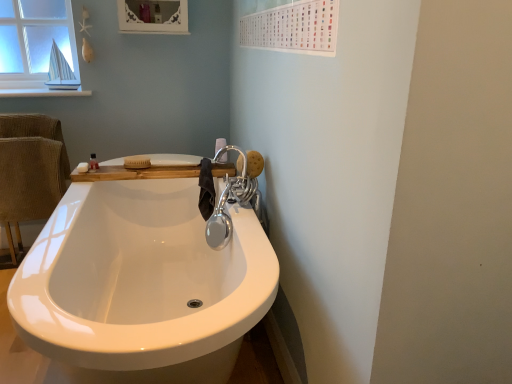
What are the coordinates of `white glossy toilet paper at upper center` in the screenshot? It's located at [220, 144].

Describe the element at coordinates (220, 144) in the screenshot. I see `white glossy toilet paper at upper center` at that location.

The width and height of the screenshot is (512, 384). In order to click on shiny metallic faucet at upper right in this screenshot , I will do `click(231, 201)`.

Describe the element at coordinates (135, 173) in the screenshot. The height and width of the screenshot is (384, 512). I see `woodenmaterial/texturecounter top at upper center` at that location.

You are a GUI agent. You are given a task and a screenshot of the screen. Output one action in this format:
    pyautogui.click(x=<x>, y=<y>)
    Task: Click on the white glossy toilet paper at upper center
    
    Given the screenshot: What is the action you would take?
    pyautogui.click(x=220, y=144)

At what (x,y) coordinates should I click in order to perform the action: click on armchair that is behind the white matte soap at upper left. Please return your answer as a coordinate pair (x, y). Looking at the image, I should click on (28, 185).

Which is behind, point (82, 166) or point (36, 213)?

Positioned behind is point (36, 213).

Based on the photo, measure the distance between white matte soap at upper left and beige corduroy armchair at left.

A distance of 22.17 inches exists between white matte soap at upper left and beige corduroy armchair at left.

Does white matte soap at upper left turn towards beige corduroy armchair at left?

No, white matte soap at upper left is not oriented towards beige corduroy armchair at left.

Can you confirm if woodenmaterial/texturecounter top at upper center is shorter than beige corduroy armchair at left?

Correct, woodenmaterial/texturecounter top at upper center is not as tall as beige corduroy armchair at left.

Is woodenmaterial/texturecounter top at upper center smaller than beige corduroy armchair at left?

Indeed, woodenmaterial/texturecounter top at upper center has a smaller size compared to beige corduroy armchair at left.

Based on their positions, is woodenmaterial/texturecounter top at upper center located to the left or right of beige corduroy armchair at left?

Based on their positions, woodenmaterial/texturecounter top at upper center is located to the right of beige corduroy armchair at left.

Where is `counter top above the beige corduroy armchair at left (from the image's perspective)`? The height and width of the screenshot is (384, 512). counter top above the beige corduroy armchair at left (from the image's perspective) is located at coordinates coord(135,173).

Is matte white medicine cabinet at upper center wider than shiny metallic faucet at upper right?

Incorrect, the width of matte white medicine cabinet at upper center does not surpass that of shiny metallic faucet at upper right.

Considering the sizes of matte white medicine cabinet at upper center and shiny metallic faucet at upper right in the image, is matte white medicine cabinet at upper center taller or shorter than shiny metallic faucet at upper right?

matte white medicine cabinet at upper center is shorter than shiny metallic faucet at upper right.

Would you say matte white medicine cabinet at upper center is a long distance from shiny metallic faucet at upper right?

That's right, there is a large distance between matte white medicine cabinet at upper center and shiny metallic faucet at upper right.

Is matte white medicine cabinet at upper center bigger or smaller than shiny metallic faucet at upper right?

Considering their sizes, matte white medicine cabinet at upper center takes up less space than shiny metallic faucet at upper right.

Is point (259, 202) closer to viewer compared to point (223, 161)?

Yes, it is in front of point (223, 161).

From a real-world perspective, is shiny metallic faucet at upper right physically above white glossy toilet paper at upper center?

No, from a real-world perspective, shiny metallic faucet at upper right is not on top of white glossy toilet paper at upper center.

Considering the sizes of shiny metallic faucet at upper right and white glossy toilet paper at upper center in the image, is shiny metallic faucet at upper right wider or thinner than white glossy toilet paper at upper center?

In the image, shiny metallic faucet at upper right appears to be wider than white glossy toilet paper at upper center.

Would you say shiny metallic faucet at upper right is to the left or to the right of white glossy toilet paper at upper center in the picture?

Clearly, shiny metallic faucet at upper right is on the right of white glossy toilet paper at upper center in the image.

In the image, is shiny metallic faucet at upper right positioned in front of or behind matte white medicine cabinet at upper center?

shiny metallic faucet at upper right is positioned closer to the viewer than matte white medicine cabinet at upper center.

Looking at the image, does shiny metallic faucet at upper right seem bigger or smaller compared to matte white medicine cabinet at upper center?

shiny metallic faucet at upper right is bigger than matte white medicine cabinet at upper center.

Is shiny metallic faucet at upper right touching matte white medicine cabinet at upper center?

There is a gap between shiny metallic faucet at upper right and matte white medicine cabinet at upper center.

In the scene shown: Can you tell me how much shiny metallic faucet at upper right and beige corduroy armchair at left differ in facing direction?

The angular difference between shiny metallic faucet at upper right and beige corduroy armchair at left is 89 degrees.

Is shiny metallic faucet at upper right taller than beige corduroy armchair at left?

Incorrect, the height of shiny metallic faucet at upper right is not larger of that of beige corduroy armchair at left.

Is shiny metallic faucet at upper right aimed at beige corduroy armchair at left?

No, shiny metallic faucet at upper right is not oriented towards beige corduroy armchair at left.

Is matte white medicine cabinet at upper center looking in the opposite direction of woodenmaterial/texturecounter top at upper center?

matte white medicine cabinet at upper center does not have its back to woodenmaterial/texturecounter top at upper center.

Consider the image. How far apart are matte white medicine cabinet at upper center and woodenmaterial/texturecounter top at upper center?

matte white medicine cabinet at upper center is 37.06 inches from woodenmaterial/texturecounter top at upper center.

Is woodenmaterial/texturecounter top at upper center completely or partially inside matte white medicine cabinet at upper center?

No, woodenmaterial/texturecounter top at upper center is not inside matte white medicine cabinet at upper center.

Between point (164, 13) and point (125, 178), which one is positioned behind?

The point (164, 13) is more distant.

Where is `armchair below the white matte soap at upper left (from a real-world perspective)`? The image size is (512, 384). armchair below the white matte soap at upper left (from a real-world perspective) is located at coordinates (28, 185).

There is a beige corduroy armchair at left. Where is `counter top above it (from a real-world perspective)`? counter top above it (from a real-world perspective) is located at coordinates (135, 173).

From the image, which object appears to be farther from beige corduroy armchair at left, white glossy toilet paper at upper center or matte white medicine cabinet at upper center?

white glossy toilet paper at upper center is positioned further to the anchor beige corduroy armchair at left.

Considering their positions, is shiny metallic faucet at upper right positioned further to white glossy toilet paper at upper center than woodenmaterial/texturecounter top at upper center?

Based on the image, woodenmaterial/texturecounter top at upper center appears to be further to white glossy toilet paper at upper center.

Considering their positions, is beige corduroy armchair at left positioned further to white matte soap at upper left than woodenmaterial/texturecounter top at upper center?

beige corduroy armchair at left lies further to white matte soap at upper left than the other object.

Estimate the real-world distances between objects in this image. Which object is closer to beige corduroy armchair at left, white glossy toilet paper at upper center or white matte soap at upper left?

white matte soap at upper left is positioned closer to the anchor beige corduroy armchair at left.

Estimate the real-world distances between objects in this image. Which object is closer to white matte soap at upper left, woodenmaterial/texturecounter top at upper center or beige corduroy armchair at left?

woodenmaterial/texturecounter top at upper center is positioned closer to the anchor white matte soap at upper left.

Looking at the image, which one is located closer to white glossy toilet paper at upper center, matte white medicine cabinet at upper center or beige corduroy armchair at left?

Based on the image, matte white medicine cabinet at upper center appears to be nearer to white glossy toilet paper at upper center.

Looking at the image, which one is located closer to woodenmaterial/texturecounter top at upper center, white glossy toilet paper at upper center or shiny metallic faucet at upper right?

shiny metallic faucet at upper right is closer to woodenmaterial/texturecounter top at upper center.

From the picture: From the image, which object appears to be nearer to shiny metallic faucet at upper right, matte white medicine cabinet at upper center or white glossy toilet paper at upper center?

white glossy toilet paper at upper center is closer to shiny metallic faucet at upper right.

I want to click on counter top between matte white medicine cabinet at upper center and beige corduroy armchair at left from top to bottom, so click(x=135, y=173).

The width and height of the screenshot is (512, 384). Find the location of `counter top between white matte soap at upper left and white glossy toilet paper at upper center`. counter top between white matte soap at upper left and white glossy toilet paper at upper center is located at coordinates (135, 173).

I want to click on counter top between matte white medicine cabinet at upper center and shiny metallic faucet at upper right from top to bottom, so click(135, 173).

This screenshot has width=512, height=384. Find the location of `toilet paper that lies between matte white medicine cabinet at upper center and white matte soap at upper left from top to bottom`. toilet paper that lies between matte white medicine cabinet at upper center and white matte soap at upper left from top to bottom is located at coordinates (220, 144).